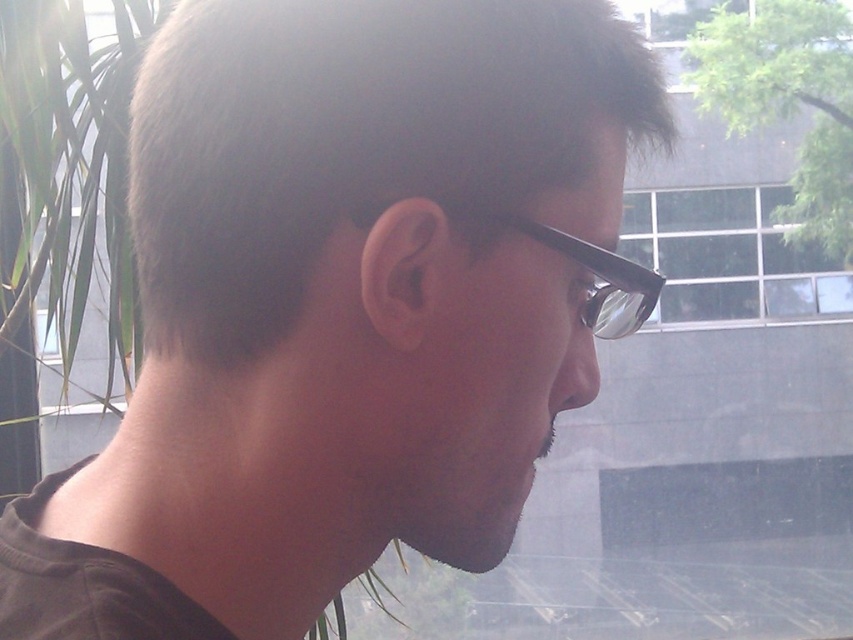
You are an interior designer planning to place a new small decorative item on the desk. The desk currently has a green leafy plant at upper right and a black plastic glasses at center. Which object would you replace if you want to make space for the new item, and why?

You should replace the green leafy plant at upper right because it is bigger than the black plastic glasses at center, so removing it would free up more space for the new decorative item.

You are an interior designer planning to place a new lamp in the room where the green leafy plant at upper right and the black plastic glasses at center are located. To ensure the lamp doesn t block the view of the glasses, where should you position it?

The green leafy plant at upper right is further to the viewer than the black plastic glasses at center. To avoid blocking the view of the glasses, the lamp should be placed behind the green leafy plant at upper right so that it doesn t obscure the glasses in the background.

You are a photographer setting up a shot of the person wearing black plastic glasses at center. You want to ensure the green leafy plant at upper right is visible in the background but not blocking the subject. Is the plant positioned in a way that allows this?

The green leafy plant at upper right is above the black plastic glasses at center, so it is positioned above the subject and can be included in the background without blocking the main focus on the glasses.